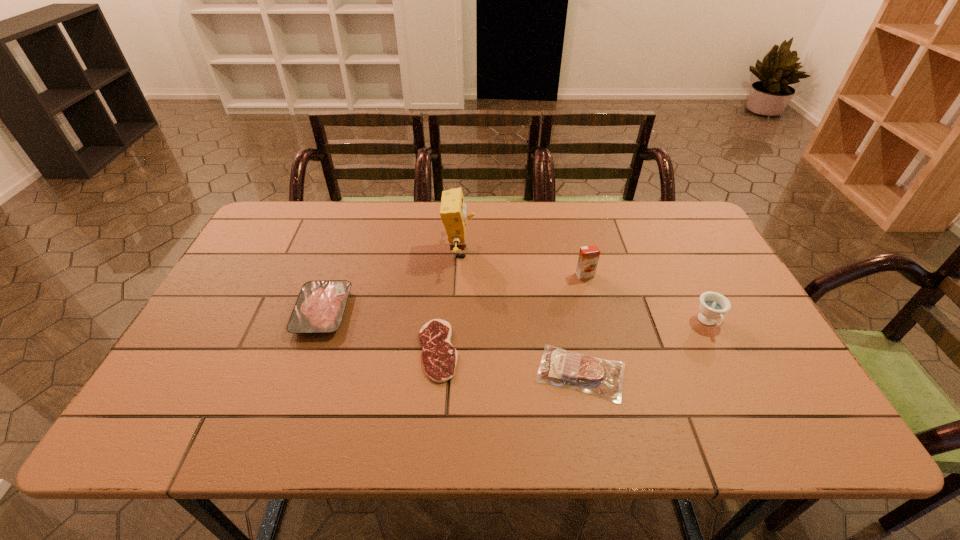
This screenshot has height=540, width=960. In order to click on vacant region at the near left corner of the desktop in this screenshot , I will do `click(203, 413)`.

Identify the location of free region at the far right corner of the desktop. (662, 211).

The image size is (960, 540). I want to click on vacant space at the near right corner, so click(822, 430).

The image size is (960, 540). In order to click on unoccupied position between the leftmost steak and the second steak from right to left in this screenshot , I will do `click(380, 331)`.

Locate an element on the screen. The height and width of the screenshot is (540, 960). free area in between the rightmost steak and the leftmost object is located at coordinates (451, 342).

This screenshot has width=960, height=540. What are the coordinates of `free spot between the sponge and the second steak from right to left` in the screenshot? It's located at (448, 301).

Where is `free space between the orange juice and the tallest object`? The image size is (960, 540). free space between the orange juice and the tallest object is located at coordinates (522, 264).

Find the location of a particular element. The image size is (960, 540). free space between the leftmost steak and the shortest object is located at coordinates (380, 331).

The image size is (960, 540). What are the coordinates of `unoccupied position between the sponge and the rightmost steak` in the screenshot? It's located at (520, 312).

Find the location of a particular element. free spot between the rightmost steak and the orange juice is located at coordinates (583, 324).